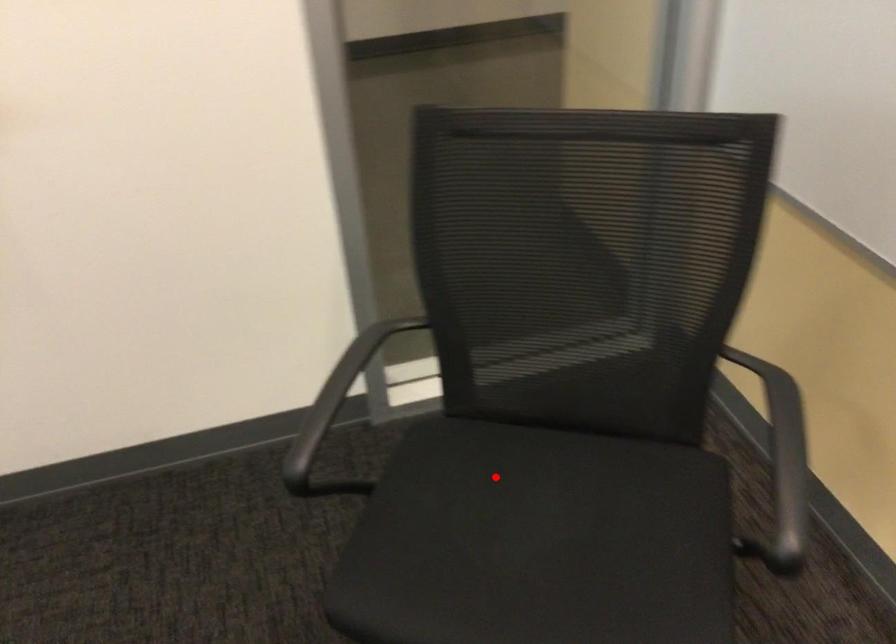
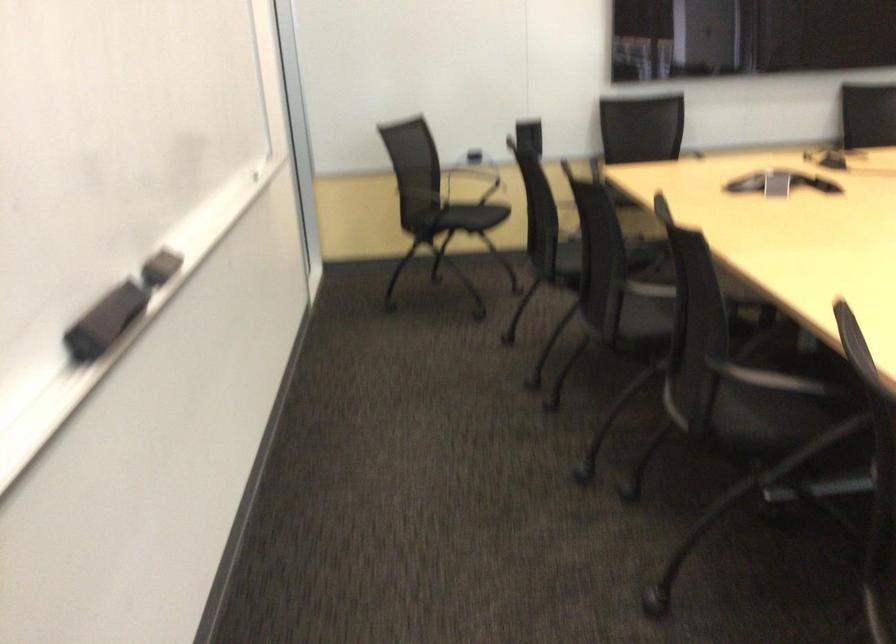
Question: I am providing you with two images of the same scene from different viewpoints. In image1, a red point is highlighted. Considering the same 3D point in image2, which of the following is correct?

Choices:
 (A) It is closer
 (B) It is farther

Answer: (B)